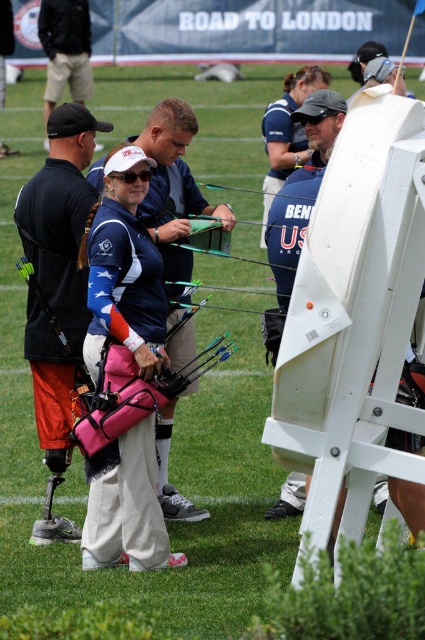
Question: In this image, where is pink fabric bow at center located relative to blue fabric shirt at center?

Choices:
 (A) above
 (B) below

Answer: (B)

Question: Can you confirm if pink fabric bow at center is wider than blue fabric shirt at center?

Choices:
 (A) yes
 (B) no

Answer: (A)

Question: Which of these objects is positioned farthest from the blue fabric shirt at center?

Choices:
 (A) pink fabric bag at center
 (B) pink fabric bow at center

Answer: (A)

Question: Estimate the real-world distances between objects in this image. Which object is farther from the pink fabric bow at center?

Choices:
 (A) blue fabric shirt at center
 (B) pink fabric bag at center

Answer: (A)

Question: Among these objects, which one is nearest to the camera?

Choices:
 (A) pink fabric bag at center
 (B) pink fabric bow at center

Answer: (A)

Question: Is pink fabric bow at center wider than blue fabric shirt at center?

Choices:
 (A) no
 (B) yes

Answer: (B)